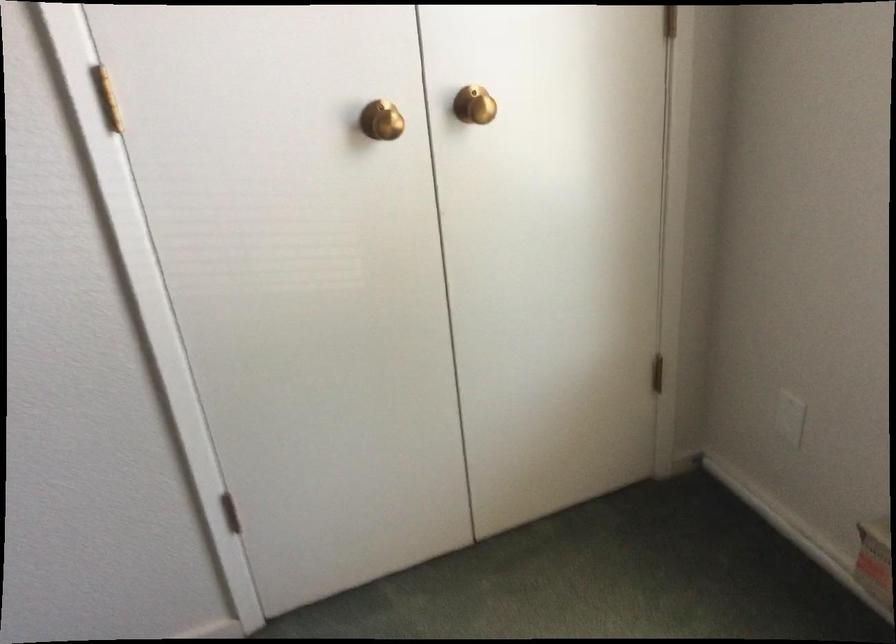
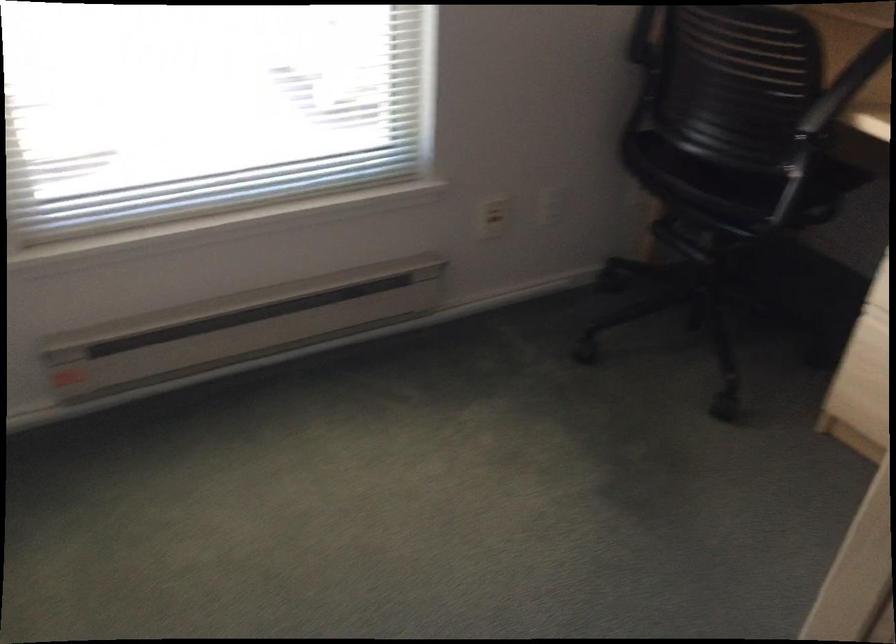
The images are taken continuously from a first-person perspective. In which direction is your viewpoint rotating?

The rotation direction of the camera is right-down.